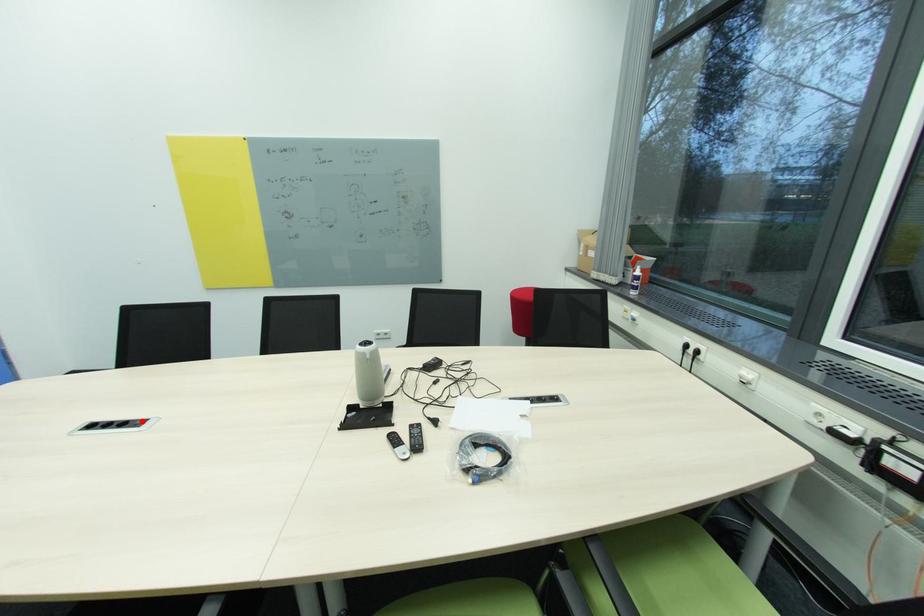
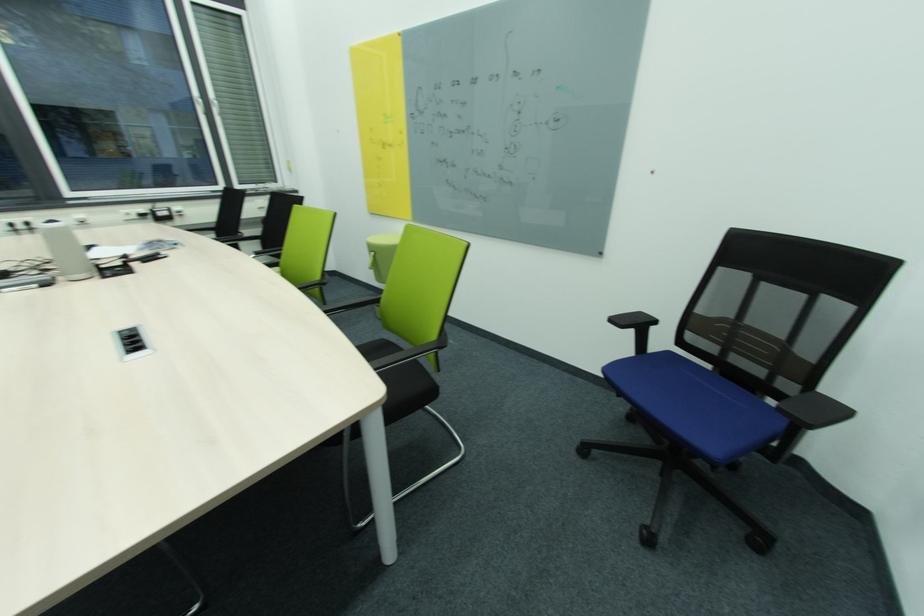
Locate, in the second image, the point that corresponds to the highlighted location in the first image.

(126, 338)